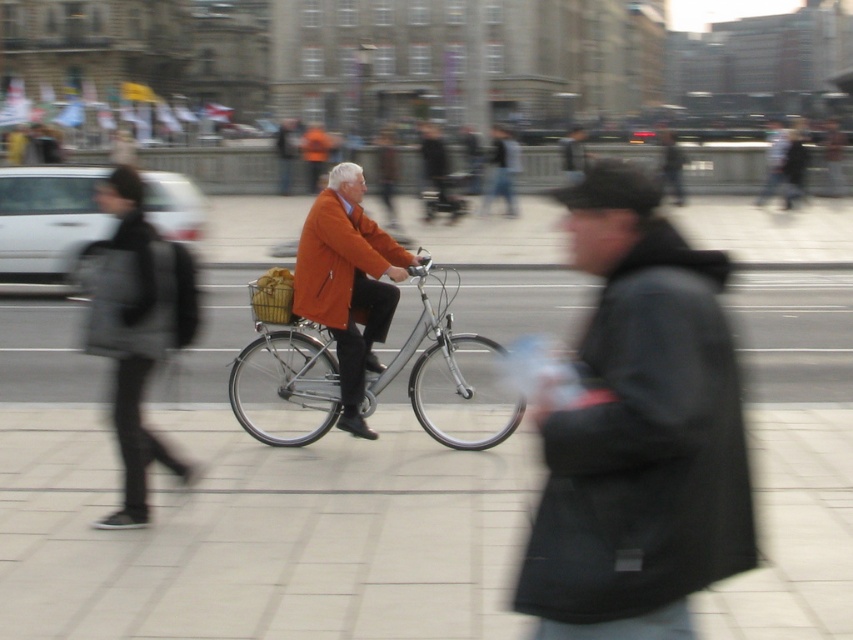
You are a delivery robot with a width of 0.8 meters. You need to navigate through the scene shown. The smooth concrete pavement at center and the black matte jacket at lower right are in your path. Can you pass through the space between them without touching either?

The smooth concrete pavement at center might be wider than black matte jacket at lower right. Since the pavement could be wider, there might be enough space for the robot to pass through safely. However, without exact measurements, it is uncertain. Proceed with caution.

You are a photographer trying to capture a detailed shot of two specific points in the urban scene. The first point is at coordinates point (345, 184), and the second point is at point (346, 269). Since you want to focus on the closer one, which point should you adjust your camera to focus on?

Point (345, 184) is closer to the viewer than point (346, 269), so you should focus on point (345, 184).